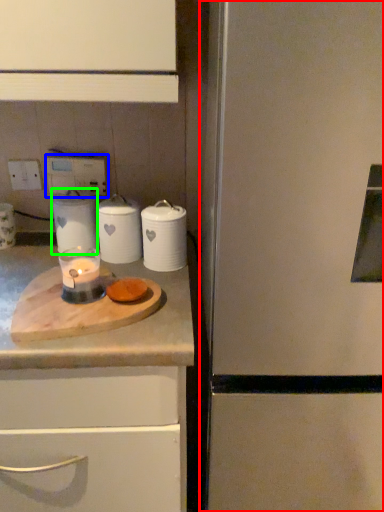
Question: Based on their relative distances, which object is farther from refrigerator (highlighted by a red box)? Choose from electric outlet (highlighted by a blue box) and kitchen appliance (highlighted by a green box).

Choices:
 (A) electric outlet
 (B) kitchen appliance

Answer: (A)